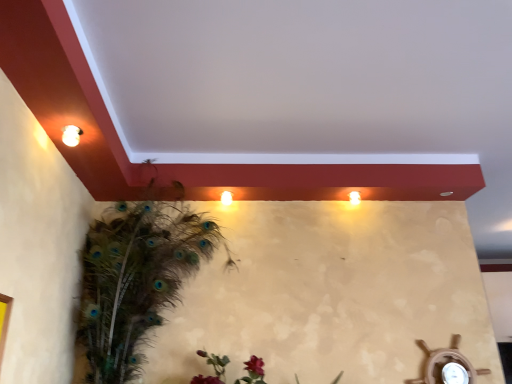
Question: From the image's perspective, is matte white light at upper right on top of feathered peacock at left?

Choices:
 (A) yes
 (B) no

Answer: (A)

Question: From a real-world perspective, is matte white light at upper right beneath feathered peacock at left?

Choices:
 (A) yes
 (B) no

Answer: (B)

Question: Is matte white light at upper right to the right of feathered peacock at left from the viewer's perspective?

Choices:
 (A) yes
 (B) no

Answer: (A)

Question: From a real-world perspective, is matte white light at upper right positioned over feathered peacock at left based on gravity?

Choices:
 (A) no
 (B) yes

Answer: (B)

Question: Could you tell me if matte white light at upper right is turned towards feathered peacock at left?

Choices:
 (A) yes
 (B) no

Answer: (B)

Question: Is feathered peacock at left spatially inside matte white light at upper right, or outside of it?

Choices:
 (A) inside
 (B) outside

Answer: (B)

Question: Looking at the image, does feathered peacock at left seem bigger or smaller compared to matte white light at upper right?

Choices:
 (A) small
 (B) big

Answer: (B)

Question: Based on their positions, is feathered peacock at left located to the left or right of matte white light at upper right?

Choices:
 (A) right
 (B) left

Answer: (B)

Question: From a real-world perspective, relative to matte white light at upper right, is feathered peacock at left vertically above or below?

Choices:
 (A) above
 (B) below

Answer: (B)

Question: Considering the positions of matte white light at upper right and feathered peacock at left in the image, is matte white light at upper right wider or thinner than feathered peacock at left?

Choices:
 (A) wide
 (B) thin

Answer: (B)

Question: Based on their positions, is matte white light at upper right located to the left or right of feathered peacock at left?

Choices:
 (A) left
 (B) right

Answer: (B)

Question: Is matte white light at upper right taller or shorter than feathered peacock at left?

Choices:
 (A) tall
 (B) short

Answer: (B)

Question: Is point (355, 200) closer or farther from the camera than point (115, 230)?

Choices:
 (A) closer
 (B) farther

Answer: (B)

Question: Considering the positions of point (81, 132) and point (113, 354), is point (81, 132) closer or farther from the camera than point (113, 354)?

Choices:
 (A) farther
 (B) closer

Answer: (B)

Question: Would you say matte white light fixture at upper left is inside or outside feathered peacock at left?

Choices:
 (A) outside
 (B) inside

Answer: (A)